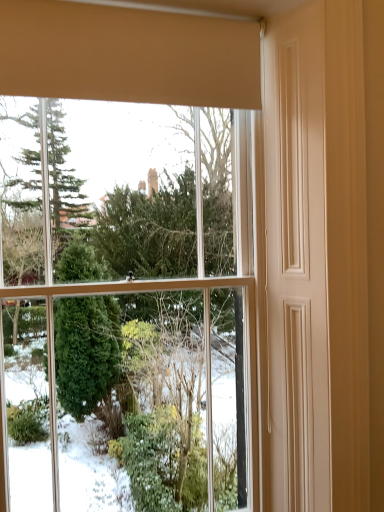
The width and height of the screenshot is (384, 512). I want to click on beige matte curtain at upper center, so click(x=127, y=55).

In order to face beige matte curtain at upper center, should I rotate leftwards or rightwards?

To align with it, rotate left about 6.825°.

What do you see at coordinates (127, 55) in the screenshot? This screenshot has width=384, height=512. I see `beige matte curtain at upper center` at bounding box center [127, 55].

The image size is (384, 512). Describe the element at coordinates (133, 50) in the screenshot. I see `clear glass window at upper center` at that location.

You are a GUI agent. You are given a task and a screenshot of the screen. Output one action in this format:
    pyautogui.click(x=<x>, y=<y>)
    Task: Click on the clear glass window at upper center
    Image resolution: width=384 pixels, height=512 pixels.
    Given the screenshot: What is the action you would take?
    pyautogui.click(x=133, y=50)

Where is `beige matte curtain at upper center`? This screenshot has height=512, width=384. beige matte curtain at upper center is located at coordinates (127, 55).

Which is more to the right, beige matte curtain at upper center or clear glass window at upper center?

Positioned to the right is beige matte curtain at upper center.

Is beige matte curtain at upper center further to the viewer compared to clear glass window at upper center?

No, the depth of beige matte curtain at upper center is less than that of clear glass window at upper center.

Is point (62, 32) farther from camera compared to point (224, 75)?

That is False.

From the image's perspective, who appears lower, beige matte curtain at upper center or clear glass window at upper center?

clear glass window at upper center is shown below in the image.

In the scene shown: From a real-world perspective, is beige matte curtain at upper center on clear glass window at upper center?

Yes, from a real-world perspective, beige matte curtain at upper center is above clear glass window at upper center.

Considering the relative sizes of beige matte curtain at upper center and clear glass window at upper center in the image provided, is beige matte curtain at upper center wider than clear glass window at upper center?

No, beige matte curtain at upper center is not wider than clear glass window at upper center.

Can you confirm if beige matte curtain at upper center is shorter than clear glass window at upper center?

Yes.

Considering the sizes of objects beige matte curtain at upper center and clear glass window at upper center in the image provided, who is smaller, beige matte curtain at upper center or clear glass window at upper center?

beige matte curtain at upper center.

Is beige matte curtain at upper center positioned beyond the bounds of clear glass window at upper center?

Yes, beige matte curtain at upper center is outside of clear glass window at upper center.

Is beige matte curtain at upper center placed right next to clear glass window at upper center?

Yes, beige matte curtain at upper center is right next to clear glass window at upper center and making contact.

Is beige matte curtain at upper center oriented towards clear glass window at upper center?

No, beige matte curtain at upper center is not facing towards clear glass window at upper center.

You are a GUI agent. You are given a task and a screenshot of the screen. Output one action in this format:
    pyautogui.click(x=<x>, y=<y>)
    Task: Click on the window behind the beige matte curtain at upper center
    This screenshot has height=512, width=384.
    Given the screenshot: What is the action you would take?
    pyautogui.click(x=133, y=50)

Between clear glass window at upper center and beige matte curtain at upper center, which one appears on the right side from the viewer's perspective?

From the viewer's perspective, beige matte curtain at upper center appears more on the right side.

Does clear glass window at upper center lie in front of beige matte curtain at upper center?

No, it is not.

Is point (37, 48) closer to camera compared to point (74, 4)?

Yes, it is.

From the image's perspective, relative to beige matte curtain at upper center, is clear glass window at upper center above or below?

clear glass window at upper center is below beige matte curtain at upper center.

From a real-world perspective, does clear glass window at upper center sit lower than beige matte curtain at upper center?

Yes, from a real-world perspective, clear glass window at upper center is beneath beige matte curtain at upper center.

Based on the photo, is clear glass window at upper center wider or thinner than beige matte curtain at upper center?

clear glass window at upper center is wider than beige matte curtain at upper center.

Can you confirm if clear glass window at upper center is taller than beige matte curtain at upper center?

Yes, clear glass window at upper center is taller than beige matte curtain at upper center.

Which of these two, clear glass window at upper center or beige matte curtain at upper center, is bigger?

Bigger between the two is clear glass window at upper center.

In the scene shown: Would you say clear glass window at upper center is outside beige matte curtain at upper center?

clear glass window at upper center is positioned outside beige matte curtain at upper center.

Looking at this image, can you see clear glass window at upper center touching beige matte curtain at upper center?

Yes, clear glass window at upper center is right next to beige matte curtain at upper center and making contact.

Is clear glass window at upper center turned away from beige matte curtain at upper center?

No, clear glass window at upper center's orientation is not away from beige matte curtain at upper center.

Locate an element on the screen. The width and height of the screenshot is (384, 512). window on the left of the beige matte curtain at upper center is located at coordinates point(133,50).

This screenshot has height=512, width=384. In order to click on curtain that is above the clear glass window at upper center (from a real-world perspective) in this screenshot , I will do `click(127, 55)`.

The width and height of the screenshot is (384, 512). I want to click on window on the left side of beige matte curtain at upper center, so click(x=133, y=50).